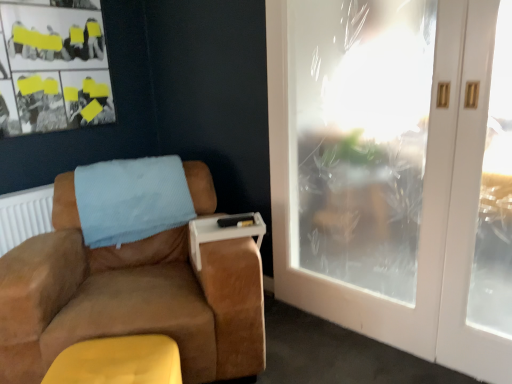
Question: Does point (72, 334) appear closer or farther from the camera than point (183, 200)?

Choices:
 (A) farther
 (B) closer

Answer: (B)

Question: From their relative heights in the image, would you say suede brown armchair at left is taller or shorter than light blue textured blanket at upper left?

Choices:
 (A) short
 (B) tall

Answer: (B)

Question: Which is nearer to the matte black bulletin board at upper left?

Choices:
 (A) light blue textured blanket at upper left
 (B) suede brown armchair at left
 (C) yellow suede footrest at lower left
 (D) white plastic tray at armrest
 (E) white frosted glass door at right

Answer: (A)

Question: Which object is positioned farthest from the white plastic tray at armrest?

Choices:
 (A) matte black bulletin board at upper left
 (B) light blue textured blanket at upper left
 (C) yellow suede footrest at lower left
 (D) white frosted glass door at right
 (E) suede brown armchair at left

Answer: (A)